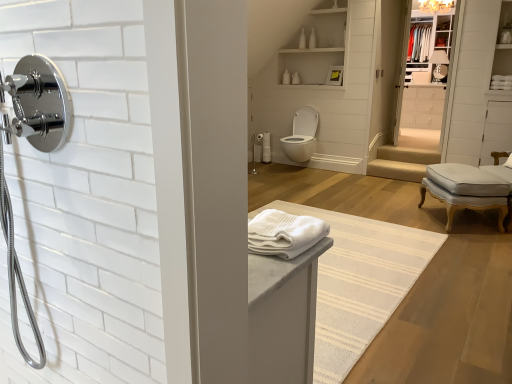
Question: Is white soft towel at center, which ranks as the first bath towel in left-to-right order, oriented towards polished chrome shower at center, which is the 1th shower in back-to-front order?

Choices:
 (A) yes
 (B) no

Answer: (B)

Question: Is white soft towel at center, the 1th bath towel positioned from the front, positioned in front of polished chrome shower at center, marked as the 2th shower in a bottom-to-top arrangement?

Choices:
 (A) no
 (B) yes

Answer: (B)

Question: From a real-world perspective, is white soft towel at center, the 2th bath towel viewed from the top, beneath polished chrome shower at center, marked as the second shower in a front-to-back arrangement?

Choices:
 (A) yes
 (B) no

Answer: (B)

Question: Is white soft towel at center, which ranks as the 2th bath towel in back-to-front order, wider than polished chrome shower at center, arranged as the first shower when viewed from the right?

Choices:
 (A) yes
 (B) no

Answer: (A)

Question: Is white soft towel at center, the 2th bath towel when ordered from right to left, not within polished chrome shower at center, which is the 1th shower in back-to-front order?

Choices:
 (A) no
 (B) yes

Answer: (B)

Question: Is white soft towel at center, which ranks as the 2th bath towel in back-to-front order, oriented away from polished chrome shower at center, marked as the second shower in a front-to-back arrangement?

Choices:
 (A) no
 (B) yes

Answer: (A)

Question: Could white glossy toilet at center be considered to be inside white glossy dresser at upper right?

Choices:
 (A) yes
 (B) no

Answer: (B)

Question: Considering the relative sizes of white glossy dresser at upper right and white glossy toilet at center in the image provided, is white glossy dresser at upper right thinner than white glossy toilet at center?

Choices:
 (A) no
 (B) yes

Answer: (B)

Question: Is white glossy dresser at upper right bigger than white glossy toilet at center?

Choices:
 (A) no
 (B) yes

Answer: (A)

Question: Is white glossy dresser at upper right further to the viewer compared to white glossy toilet at center?

Choices:
 (A) yes
 (B) no

Answer: (A)

Question: From a real-world perspective, is white glossy dresser at upper right positioned under white glossy toilet at center based on gravity?

Choices:
 (A) yes
 (B) no

Answer: (B)

Question: Is white glossy dresser at upper right with white glossy toilet at center?

Choices:
 (A) yes
 (B) no

Answer: (B)

Question: Is beige fabric stair at center thinner than polished chrome showerhead at left, the second shower from the right?

Choices:
 (A) no
 (B) yes

Answer: (A)